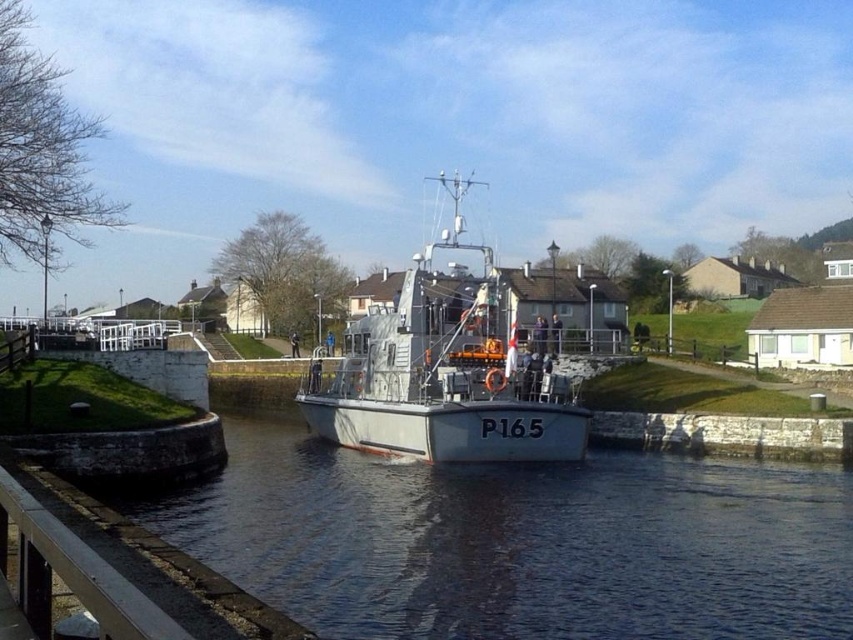
Can you confirm if white smooth water at center is smaller than metallic gray boat at center?

Yes.

Between white smooth water at center and metallic gray boat at center, which one is positioned higher?

metallic gray boat at center

Identify the location of white smooth water at center. (520, 541).